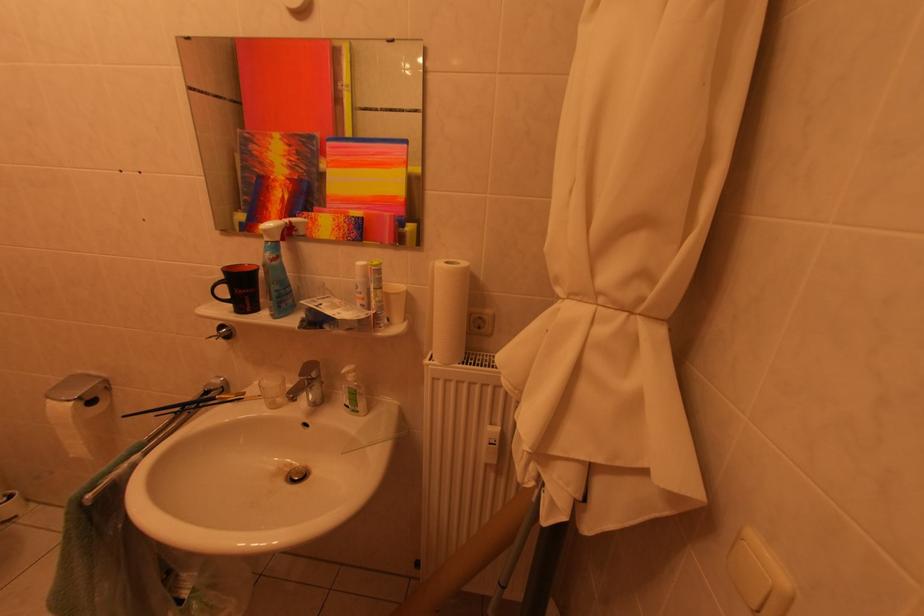
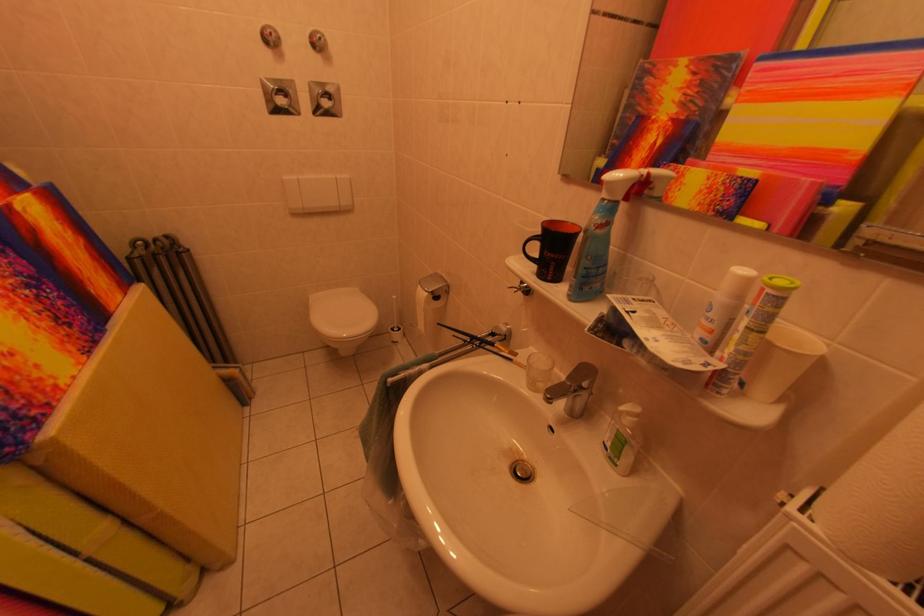
Find the pixel in the second image that matches (x=59, y=407) in the first image.

(429, 292)